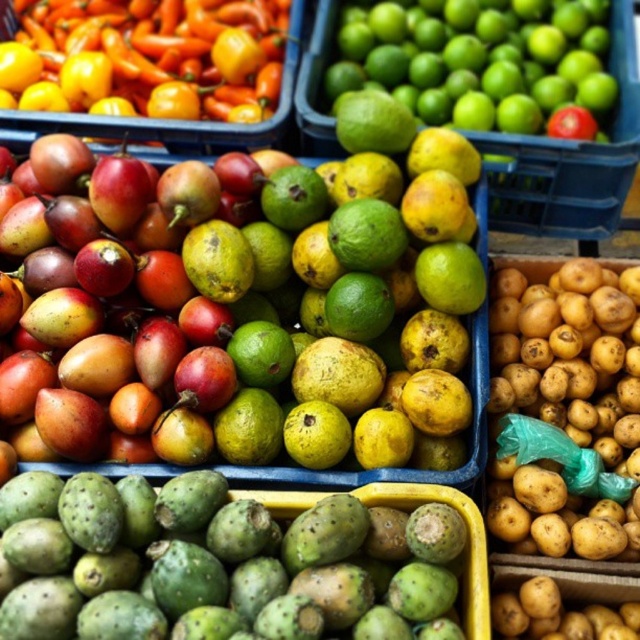
You are a customer at the market stall and you want to buy a lime. You see the green matte lime at upper right. Can you reach it without moving from your current position?

The green matte lime at upper right is 1.37 meters away from camera, so it is out of reach unless you move closer.

You are a customer at the market stall and want to place the green prickly at bottom left and the smooth orange peppers at upper left into a bag. Which object should you place first to ensure the bag can hold both?

The green prickly at bottom left might be wider than smooth orange peppers at upper left, so you should place the wider one first to ensure the bag can accommodate both.

You are a customer at the market stall and want to buy a fruit that is wider. Which one should you choose between the green prickly at bottom left and the green matte limes at upper right?

The green prickly at bottom left might be wider than the green matte limes at upper right according to the description, so you should choose the green prickly at bottom left.